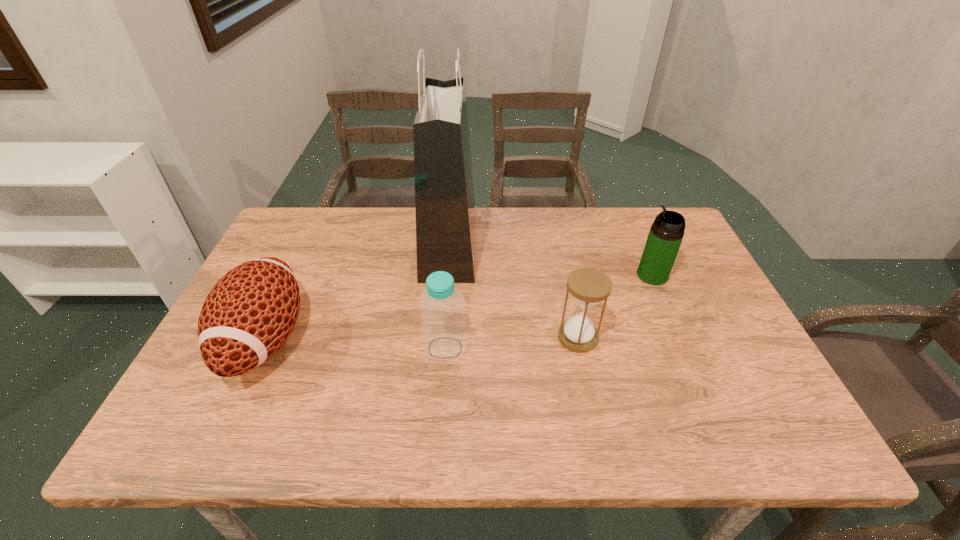
You are a GUI agent. You are given a task and a screenshot of the screen. Output one action in this format:
    pyautogui.click(x=<x>, y=<y>)
    Task: Click on the tallest object
    This screenshot has height=540, width=960.
    Given the screenshot: What is the action you would take?
    pyautogui.click(x=445, y=208)

This screenshot has height=540, width=960. In order to click on the rightmost object in this screenshot , I will do `click(665, 236)`.

You are a GUI agent. You are given a task and a screenshot of the screen. Output one action in this format:
    pyautogui.click(x=<x>, y=<y>)
    Task: Click on the bottle
    This screenshot has width=960, height=540.
    Given the screenshot: What is the action you would take?
    pyautogui.click(x=443, y=328)

Where is `the leftmost object`? Image resolution: width=960 pixels, height=540 pixels. the leftmost object is located at coordinates (248, 315).

I want to click on the second object from right to left, so click(x=588, y=286).

Where is `vacant space located on the front with handles of the shopping bag`? This screenshot has width=960, height=540. vacant space located on the front with handles of the shopping bag is located at coordinates (586, 243).

I want to click on free space located from the spout of the thermos bottle, so click(593, 275).

Identify the location of vacant region located from the spout of the thermos bottle. The height and width of the screenshot is (540, 960). (579, 275).

Find the location of a particular element. vacant space located 0.110m from the spout of the thermos bottle is located at coordinates (597, 275).

The image size is (960, 540). I want to click on vacant position located 0.090m on the left of the bottle, so click(384, 348).